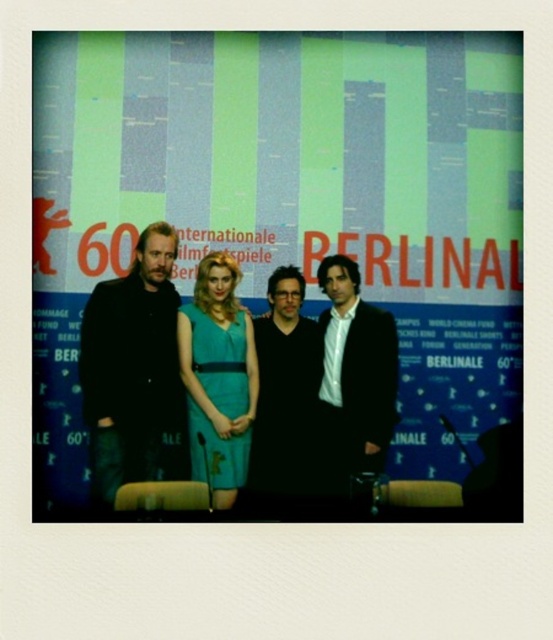
You are attending the Berlinale and notice two outfits on the panelists at center. The white shirt at center and the teal satin dress at center. Which one is positioned lower on the panelist?

The white shirt at center is located below the teal satin dress at center, so the white shirt at center is positioned lower on the panelist.

You are a photographer at the Berlinale press conference. You need to capture a group photo of the panelists. The two central figures are wearing a white shirt at center and a teal satin dress at center. Considering their clothing widths, which one should you focus on to ensure their outfit details are sharp in the photo?

The white shirt at center has a smaller width compared to the teal satin dress at center. To ensure the outfit details are sharp, focus on the teal satin dress at center since it has a larger surface area for better focus.

You are attending the Berlinale and need to identify the panelist wearing a matte black suit at left and the one in a black matte vest at center. Which panelist is standing to the right of the other?

The black matte vest at center is to the right of the matte black suit at left.